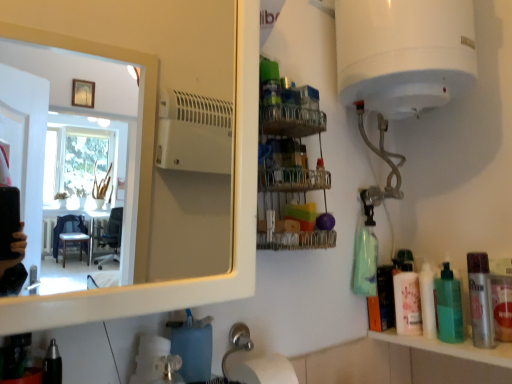
Image resolution: width=512 pixels, height=384 pixels. What do you see at coordinates (448, 306) in the screenshot? I see `green translucent bottle at right, placed as the first mouthwash when sorted from back to front` at bounding box center [448, 306].

Describe the element at coordinates (407, 296) in the screenshot. I see `pink matte lotion at right, the second toiletry viewed from the left` at that location.

This screenshot has width=512, height=384. Describe the element at coordinates (52, 365) in the screenshot. I see `black plastic pen at lower left, the 2th toiletry from the right` at that location.

This screenshot has width=512, height=384. What do you see at coordinates (428, 301) in the screenshot? I see `matte white bottle at right` at bounding box center [428, 301].

What are the coordinates of `matte white bottle at right` in the screenshot? It's located at (428, 301).

This screenshot has width=512, height=384. Identify the location of green translucent bottle at right, which appears as the 2th mouthwash when viewed from the front. (448, 306).

From a real-world perspective, is silver metallic mouthwash at right, the 2th mouthwash positioned from the back, physically below black plastic pen at lower left, marked as the second toiletry in a back-to-front arrangement?

No, from a real-world perspective, silver metallic mouthwash at right, the 2th mouthwash positioned from the back, is not under black plastic pen at lower left, marked as the second toiletry in a back-to-front arrangement.

How distant is silver metallic mouthwash at right, the 2th mouthwash positioned from the back, from black plastic pen at lower left, the 1th toiletry from the left?

silver metallic mouthwash at right, the 2th mouthwash positioned from the back, and black plastic pen at lower left, the 1th toiletry from the left, are 95.19 centimeters apart.

Considering the sizes of silver metallic mouthwash at right, the 2th mouthwash positioned from the back, and black plastic pen at lower left, arranged as the first toiletry when viewed from the front, in the image, is silver metallic mouthwash at right, the 2th mouthwash positioned from the back, bigger or smaller than black plastic pen at lower left, arranged as the first toiletry when viewed from the front,?

In the image, silver metallic mouthwash at right, the 2th mouthwash positioned from the back, appears to be larger than black plastic pen at lower left, arranged as the first toiletry when viewed from the front.

Is point (475, 254) closer or farther from the camera than point (49, 364)?

Point (475, 254) is positioned farther from the camera compared to point (49, 364).

Is white glossy mirror at upper left oriented away from metallic wire rack at upper center?

No, white glossy mirror at upper left's orientation is not away from metallic wire rack at upper center.

Considering the sizes of objects white glossy mirror at upper left and metallic wire rack at upper center in the image provided, who is taller, white glossy mirror at upper left or metallic wire rack at upper center?

white glossy mirror at upper left.

Is white glossy mirror at upper left not near metallic wire rack at upper center?

white glossy mirror at upper left is far away from metallic wire rack at upper center.

Between point (163, 172) and point (262, 82), which one is positioned in front?

The point (262, 82) is more forward.

In terms of height, does matte white bottle at right look taller or shorter compared to green translucent bottle at right, which appears as the 2th mouthwash when viewed from the front?

In the image, matte white bottle at right appears to be shorter than green translucent bottle at right, which appears as the 2th mouthwash when viewed from the front.

Which is behind, matte white bottle at right or green translucent bottle at right, placed as the first mouthwash when sorted from back to front?

matte white bottle at right.

Could you tell me if matte white bottle at right is turned towards green translucent bottle at right, placed as the first mouthwash when sorted from back to front?

No.

Where is `toiletry located on the right of black plastic pen at lower left, the 2th toiletry from the right`? toiletry located on the right of black plastic pen at lower left, the 2th toiletry from the right is located at coordinates (407, 296).

Is black plastic pen at lower left, arranged as the first toiletry when viewed from the front, aimed at pink matte lotion at right, the 1th toiletry in the right-to-left sequence?

No, black plastic pen at lower left, arranged as the first toiletry when viewed from the front, does not turn towards pink matte lotion at right, the 1th toiletry in the right-to-left sequence.

Considering the relative sizes of black plastic pen at lower left, the 2th toiletry from the right, and pink matte lotion at right, the first toiletry viewed from the back, in the image provided, is black plastic pen at lower left, the 2th toiletry from the right, thinner than pink matte lotion at right, the first toiletry viewed from the back,?

Yes.

Is black plastic pen at lower left, the 2th toiletry from the right, positioned far away from pink matte lotion at right, which ranks as the 2th toiletry in front-to-back order?

No, black plastic pen at lower left, the 2th toiletry from the right, is not far away from pink matte lotion at right, which ranks as the 2th toiletry in front-to-back order.

How distant is black plastic pen at lower left, the 1th toiletry from the left, from white glossy mirror at upper left?

They are 14.63 feet apart.

Which of these two, black plastic pen at lower left, the 1th toiletry from the left, or white glossy mirror at upper left, stands shorter?

With less height is black plastic pen at lower left, the 1th toiletry from the left.

Between point (59, 353) and point (31, 183), which one is positioned behind?

The point (31, 183) is farther from the camera.

Which object is positioned more to the right, black plastic pen at lower left, the 2th toiletry from the right, or white glossy mirror at upper left?

From the viewer's perspective, white glossy mirror at upper left appears more on the right side.

Does pink matte lotion at right, the second toiletry viewed from the left, turn towards green translucent bottle at right, which appears as the 2th mouthwash when viewed from the front?

No, pink matte lotion at right, the second toiletry viewed from the left, is not turned towards green translucent bottle at right, which appears as the 2th mouthwash when viewed from the front.

Do you think pink matte lotion at right, the first toiletry viewed from the back, is within green translucent bottle at right, placed as the first mouthwash when sorted from back to front, or outside of it?

pink matte lotion at right, the first toiletry viewed from the back, is not inside green translucent bottle at right, placed as the first mouthwash when sorted from back to front, it's outside.

Does point (403, 326) come farther from viewer compared to point (449, 267)?

No, it is not.

From the image's perspective, would you say pink matte lotion at right, the 1th toiletry in the right-to-left sequence, is shown under green translucent bottle at right, placed as the first mouthwash when sorted from back to front?

Yes, from the image's perspective, pink matte lotion at right, the 1th toiletry in the right-to-left sequence, is beneath green translucent bottle at right, placed as the first mouthwash when sorted from back to front.

In the image, is white glossy mirror at upper left on the left side or the right side of pink matte lotion at right, the first toiletry viewed from the back?

Clearly, white glossy mirror at upper left is on the left of pink matte lotion at right, the first toiletry viewed from the back, in the image.

Consider the image. Is white glossy mirror at upper left with pink matte lotion at right, which ranks as the 2th toiletry in front-to-back order?

No, white glossy mirror at upper left is not making contact with pink matte lotion at right, which ranks as the 2th toiletry in front-to-back order.

Find the location of a particular element. mirror to the left of pink matte lotion at right, the 1th toiletry in the right-to-left sequence is located at coordinates (74, 153).

Considering their positions, is white glossy mirror at upper left located in front of or behind pink matte lotion at right, which ranks as the 2th toiletry in front-to-back order?

In the image, white glossy mirror at upper left appears in front of pink matte lotion at right, which ranks as the 2th toiletry in front-to-back order.

From a real-world perspective, which toiletry is the 2nd one underneath the silver metallic mouthwash at right, the 2th mouthwash positioned from the back? Please provide its 2D coordinates.

[(52, 365)]

You are a GUI agent. You are given a task and a screenshot of the screen. Output one action in this format:
    pyautogui.click(x=<x>, y=<y>)
    Task: Click on the mirror in front of the metallic wire rack at upper center
    Image resolution: width=512 pixels, height=384 pixels.
    Given the screenshot: What is the action you would take?
    click(x=74, y=153)

Looking at the image, which one is located further to black plastic pen at lower left, marked as the second toiletry in a back-to-front arrangement, matte white bottle at right or metallic wire rack at upper center?

Based on the image, matte white bottle at right appears to be further to black plastic pen at lower left, marked as the second toiletry in a back-to-front arrangement.

Considering their positions, is green translucent bottle at right, which appears as the 2th mouthwash when viewed from the front, positioned further to white glossy mirror at upper left than metallic wire rack at upper center?

The object further to white glossy mirror at upper left is green translucent bottle at right, which appears as the 2th mouthwash when viewed from the front.

Considering their positions, is matte white bottle at right positioned further to silver metallic mouthwash at right, which appears as the 1th mouthwash when viewed from the front, than white glossy mirror at upper left?

white glossy mirror at upper left is further to silver metallic mouthwash at right, which appears as the 1th mouthwash when viewed from the front.

Based on their spatial positions, is black plastic pen at lower left, the 1th toiletry from the left, or white glossy mirror at upper left closer to metallic wire rack at upper center?

black plastic pen at lower left, the 1th toiletry from the left, is positioned closer to the anchor metallic wire rack at upper center.

Estimate the real-world distances between objects in this image. Which object is further from metallic wire rack at upper center, matte white bottle at right or silver metallic mouthwash at right, the 2th mouthwash positioned from the back?

silver metallic mouthwash at right, the 2th mouthwash positioned from the back, is further to metallic wire rack at upper center.

Based on their spatial positions, is matte white bottle at right or pink matte lotion at right, the second toiletry viewed from the left, further from black plastic pen at lower left, marked as the second toiletry in a back-to-front arrangement?

matte white bottle at right is positioned further to the anchor black plastic pen at lower left, marked as the second toiletry in a back-to-front arrangement.

Considering their positions, is pink matte lotion at right, the 1th toiletry in the right-to-left sequence, positioned further to matte white bottle at right than silver metallic mouthwash at right, which appears as the 1th mouthwash when viewed from the front?

silver metallic mouthwash at right, which appears as the 1th mouthwash when viewed from the front, is positioned further to the anchor matte white bottle at right.

Which object lies nearer to the anchor point metallic wire rack at upper center, silver metallic mouthwash at right, the 2th mouthwash positioned from the back, or green translucent bottle at right, which appears as the 2th mouthwash when viewed from the front?

green translucent bottle at right, which appears as the 2th mouthwash when viewed from the front.

Where is `toiletry between black plastic pen at lower left, the 1th toiletry from the left, and green translucent bottle at right, placed as the first mouthwash when sorted from back to front, in the horizontal direction`? The height and width of the screenshot is (384, 512). toiletry between black plastic pen at lower left, the 1th toiletry from the left, and green translucent bottle at right, placed as the first mouthwash when sorted from back to front, in the horizontal direction is located at coordinates (407, 296).

Locate an element on the screen. shelf between white glossy mirror at upper left and green translucent bottle at right, which appears as the 2th mouthwash when viewed from the front, in the horizontal direction is located at coordinates (289, 165).

Identify the location of mirror between black plastic pen at lower left, the 2th toiletry from the right, and pink matte lotion at right, the 1th toiletry in the right-to-left sequence, from left to right. This screenshot has width=512, height=384. click(x=74, y=153).

In order to click on mouthwash between black plastic pen at lower left, the 2th toiletry from the right, and silver metallic mouthwash at right, the 2th mouthwash positioned from the back, in the horizontal direction in this screenshot , I will do `click(448, 306)`.